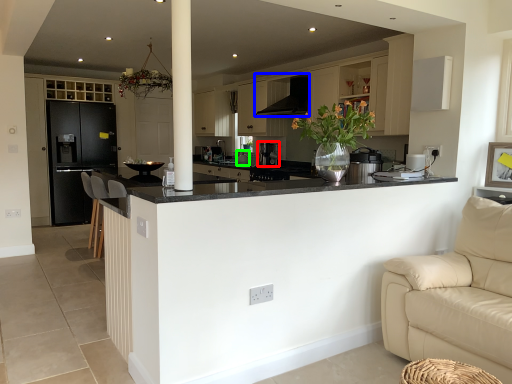
Question: Which is farther away from coffee machine (highlighted by a red box)? exhaust hood (highlighted by a blue box) or appliance (highlighted by a green box)?

Choices:
 (A) exhaust hood
 (B) appliance

Answer: (A)